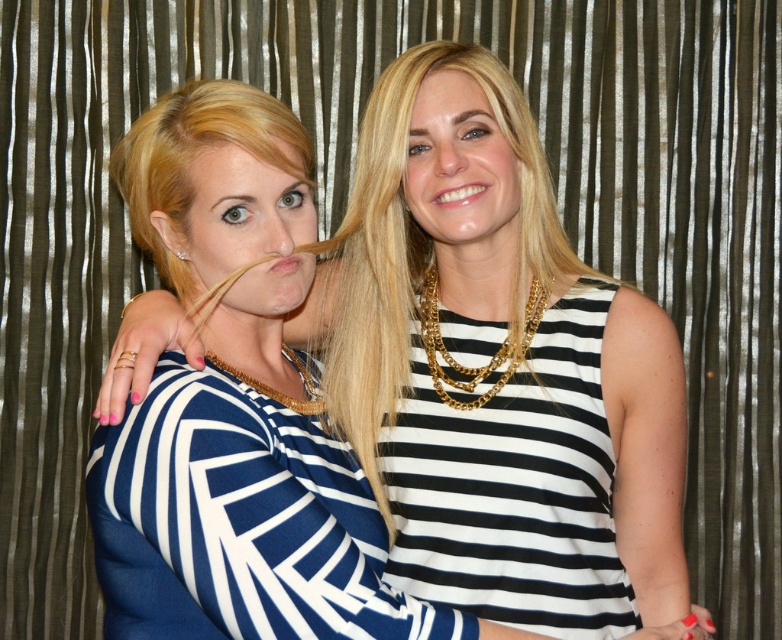
You are taking a photo of two people standing against a striped background. You want to focus on the person closer to the camera. Which point should you focus on, point (504, 348) or point (275, 483)?

Point (504, 348) is further to the camera than point (275, 483), so you should focus on point (504, 348) to capture the person closer to the camera.

In the scene shown: You are a photographer standing at a distance of 4 feet from the scene. You want to capture a closeup shot of the blue striped dress at center. Based on the given information, will you be able to focus on the dress without moving closer?

The blue striped dress at center is 3.54 feet away from the camera. Since you are standing 4 feet away from the scene, you are slightly farther than the dress. To focus on the dress without moving closer, ensure your camera has a zoom lens or autofocus capability to adjust the focus at this distance.